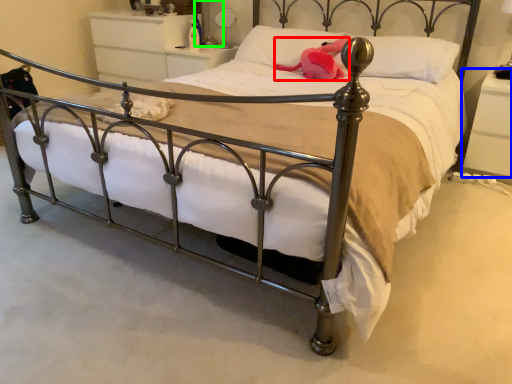
Question: Which object is the closest to the animal (highlighted by a red box)? Choose among these: nightstand (highlighted by a blue box) or table lamp (highlighted by a green box).

Choices:
 (A) nightstand
 (B) table lamp

Answer: (A)